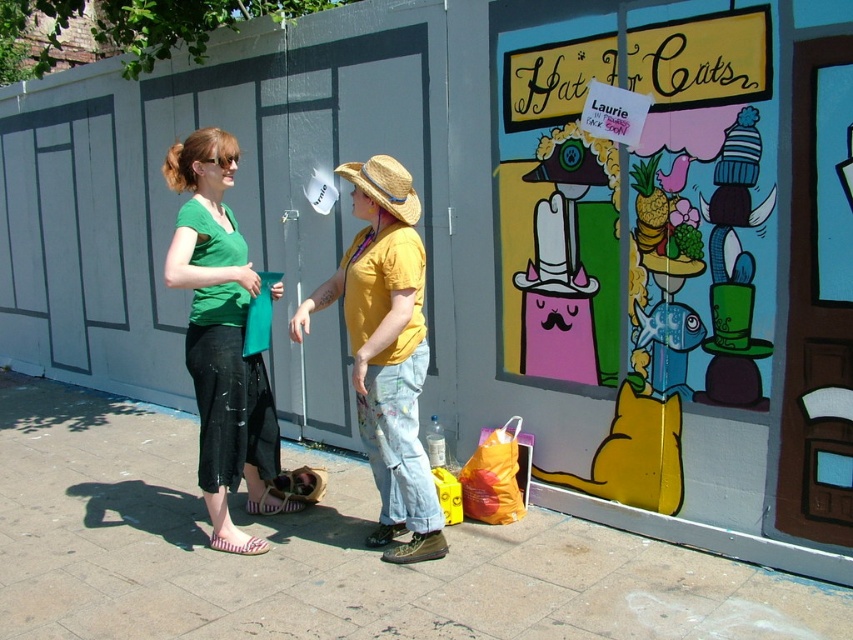
Question: Among these points, which one is nearest to the camera?

Choices:
 (A) (236, 212)
 (B) (218, 195)
 (C) (413, 512)
 (D) (476, 516)

Answer: (C)

Question: Which point appears closest to the camera in this image?

Choices:
 (A) (24, 484)
 (B) (80, 68)
 (C) (403, 168)
 (D) (222, 413)

Answer: (C)

Question: Can you confirm if smooth gray garage door at center is positioned above strawmaterial/texturehat at center?

Choices:
 (A) no
 (B) yes

Answer: (B)

Question: Does orange plastic bag at lower center appear over strawmaterial/texturehat at center?

Choices:
 (A) no
 (B) yes

Answer: (A)

Question: Which object is the closest to the smooth concrete pavement at center?

Choices:
 (A) green matte shirt at center
 (B) orange plastic bag at lower center

Answer: (B)

Question: Does smooth gray garage door at center have a greater width compared to orange plastic bag at lower center?

Choices:
 (A) yes
 (B) no

Answer: (A)